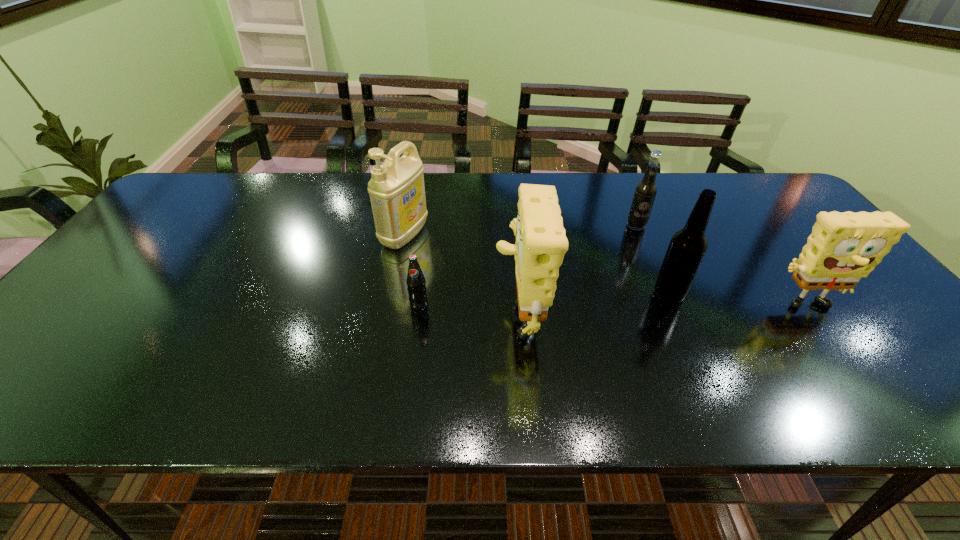
In the current image, all sponges are evenly spaced. To maintain this equal spacing, where should an additional sponge be placed on the left? Please point out a free spot. Please provide its 2D coordinates. Your answer should be formatted as a tuple, i.e. [(x, y)], where the tuple contains the x and y coordinates of a point satisfying the conditions above.

[(230, 318)]